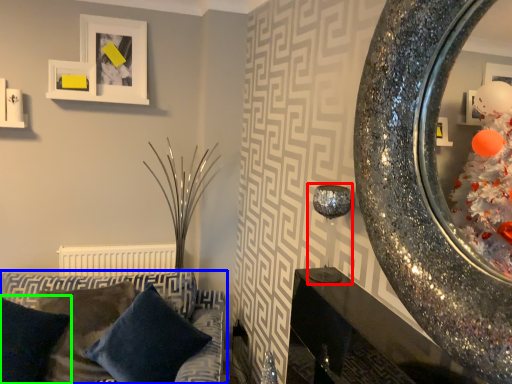
Question: Based on their relative distances, which object is farther from candle holder (highlighted by a red box)? Choose from studio couch (highlighted by a blue box) and pillow (highlighted by a green box).

Choices:
 (A) studio couch
 (B) pillow

Answer: (B)